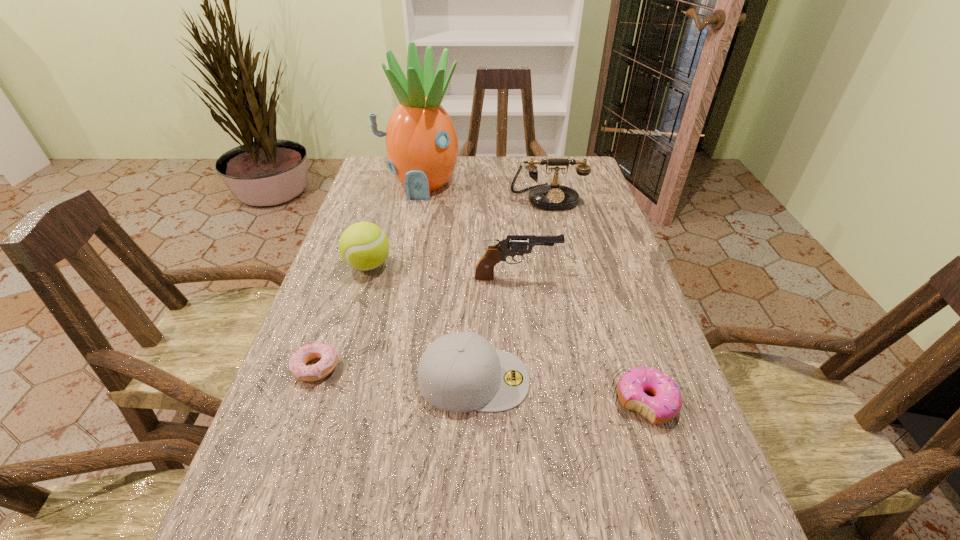
Find the location of a particular element. the tallest object is located at coordinates (422, 147).

The height and width of the screenshot is (540, 960). I want to click on telephone, so (554, 196).

This screenshot has height=540, width=960. I want to click on gun, so click(484, 271).

This screenshot has height=540, width=960. Identify the location of tennis ball. (364, 246).

What are the coordinates of `cap` in the screenshot? It's located at (459, 372).

The width and height of the screenshot is (960, 540). Identify the location of the right doughnut. (666, 404).

You are a GUI agent. You are given a task and a screenshot of the screen. Output one action in this format:
    pyautogui.click(x=<x>, y=<y>)
    Task: Click on the taller doughnut
    
    Given the screenshot: What is the action you would take?
    pyautogui.click(x=666, y=404)

Where is `the shortest object`? This screenshot has width=960, height=540. the shortest object is located at coordinates (297, 364).

Identify the location of the shorter doughnut. This screenshot has width=960, height=540. (297, 364).

You are a GUI agent. You are given a task and a screenshot of the screen. Output one action in this format:
    pyautogui.click(x=<x>, y=<y>)
    Task: Click on the vacant point located at the entrance of the pineapple
    Image resolution: width=960 pixels, height=540 pixels.
    Given the screenshot: What is the action you would take?
    pyautogui.click(x=399, y=288)